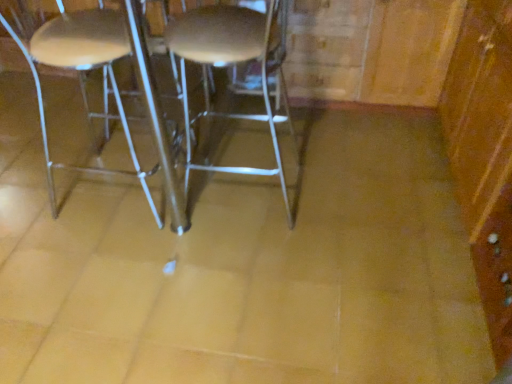
Find the location of a particular element. vacant position to the left of metallic silver stool at left is located at coordinates (45, 188).